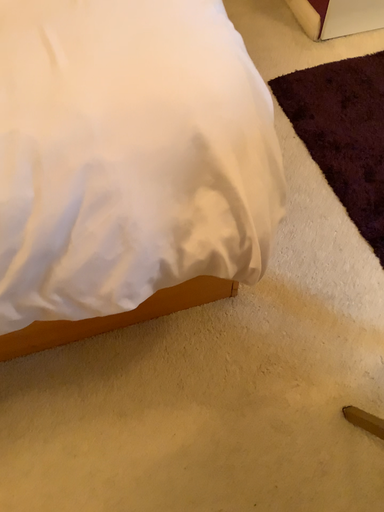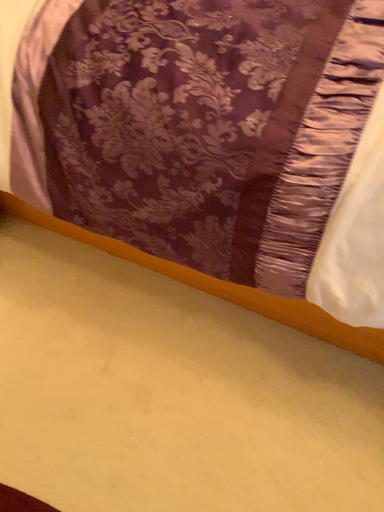
Question: Which way did the camera rotate in the video?

Choices:
 (A) rotated downward
 (B) rotated upward

Answer: (B)